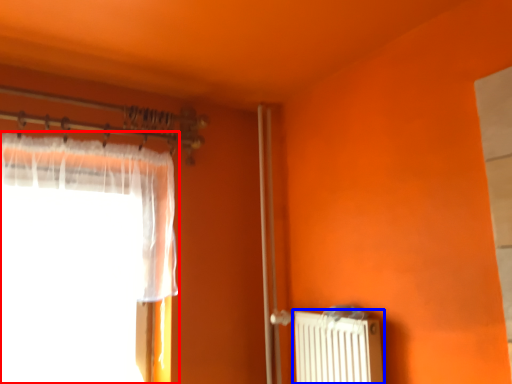
Question: Which object appears farthest to the camera in this image, curtain (highlighted by a red box) or radiator (highlighted by a blue box)?

Choices:
 (A) curtain
 (B) radiator

Answer: (B)